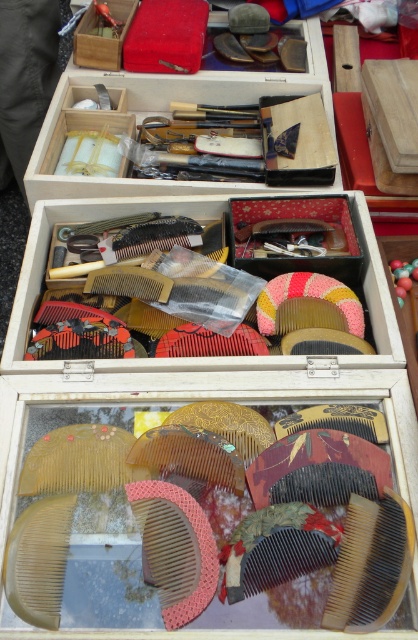
Who is more distant from viewer, (x=53, y=202) or (x=33, y=620)?

The point (x=53, y=202) is more distant.

Can you confirm if translucent plastic combs at center is positioned to the right of translucent amber comb at lower left?

Indeed, translucent plastic combs at center is positioned on the right side of translucent amber comb at lower left.

From the picture: Who is more distant from viewer, (x=331, y=365) or (x=22, y=532)?

The point (x=331, y=365) is more distant.

Find the location of a particular element. The width and height of the screenshot is (418, 640). translucent plastic combs at center is located at coordinates (196, 358).

Based on the photo, can you confirm if translucent plastic combs at center is shorter than brown wooden comb at center?

In fact, translucent plastic combs at center may be taller than brown wooden comb at center.

Does translucent plastic combs at center have a greater width compared to brown wooden comb at center?

Correct, the width of translucent plastic combs at center exceeds that of brown wooden comb at center.

Measure the distance between translucent plastic combs at center and camera.

translucent plastic combs at center is 77.61 centimeters away from camera.

Image resolution: width=418 pixels, height=640 pixels. In order to click on translucent plastic combs at center in this screenshot , I will do `click(196, 358)`.

Measure the distance between brown wooden comb at center and translucent amber comb at lower left.

brown wooden comb at center is 16.69 inches from translucent amber comb at lower left.

Can you confirm if brown wooden comb at center is bigger than translucent amber comb at lower left?

Correct, brown wooden comb at center is larger in size than translucent amber comb at lower left.

Between point (341, 572) and point (48, 618), which one is positioned behind?

The point (341, 572) is more distant.

Locate an element on the screen. brown wooden comb at center is located at coordinates (371, 564).